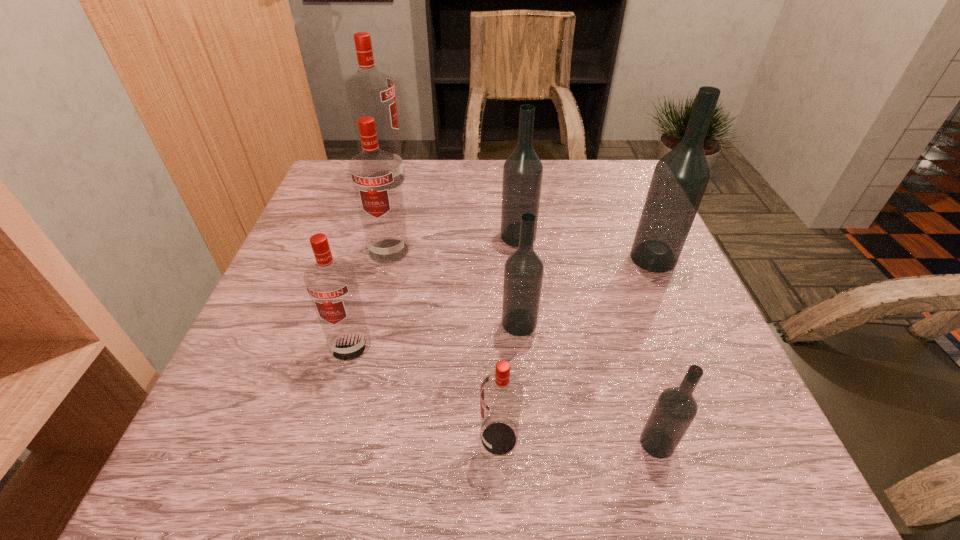
The width and height of the screenshot is (960, 540). In order to click on object that is the third closest one to the second nearest black vodka in this screenshot , I will do `click(675, 409)`.

The width and height of the screenshot is (960, 540). Identify the location of vodka that is the third closest to the smallest red vodka. (331, 283).

The width and height of the screenshot is (960, 540). I want to click on the closest vodka to the nearest black vodka, so click(x=501, y=393).

The image size is (960, 540). In order to click on red vodka that is the nearest to the biggest red vodka in this screenshot , I will do (375, 174).

Where is `red vodka that is the fourth closest to the second biggest black vodka`? This screenshot has height=540, width=960. red vodka that is the fourth closest to the second biggest black vodka is located at coordinates (501, 393).

Find the location of `the third closest black vodka to the biggest red vodka`. the third closest black vodka to the biggest red vodka is located at coordinates (680, 178).

The width and height of the screenshot is (960, 540). Find the location of `the closest black vodka to the third smallest black vodka`. the closest black vodka to the third smallest black vodka is located at coordinates (523, 273).

You are a GUI agent. You are given a task and a screenshot of the screen. Output one action in this format:
    pyautogui.click(x=<x>, y=<y>)
    Task: Click on the free region that satisfies the following two spatial constraints: 1. on the front label of the third farthest red vodka; 2. on the left side of the second black vodka from right to left
    The image size is (960, 540).
    Given the screenshot: What is the action you would take?
    tap(324, 443)

Locate an element on the screen. The image size is (960, 540). vacant space that satisfies the following two spatial constraints: 1. on the front label of the farthest red vodka; 2. on the back side of the third smallest black vodka is located at coordinates (368, 236).

Locate an element on the screen. vacant space that satisfies the following two spatial constraints: 1. on the front label of the farthest red vodka; 2. on the back side of the third farthest black vodka is located at coordinates click(342, 323).